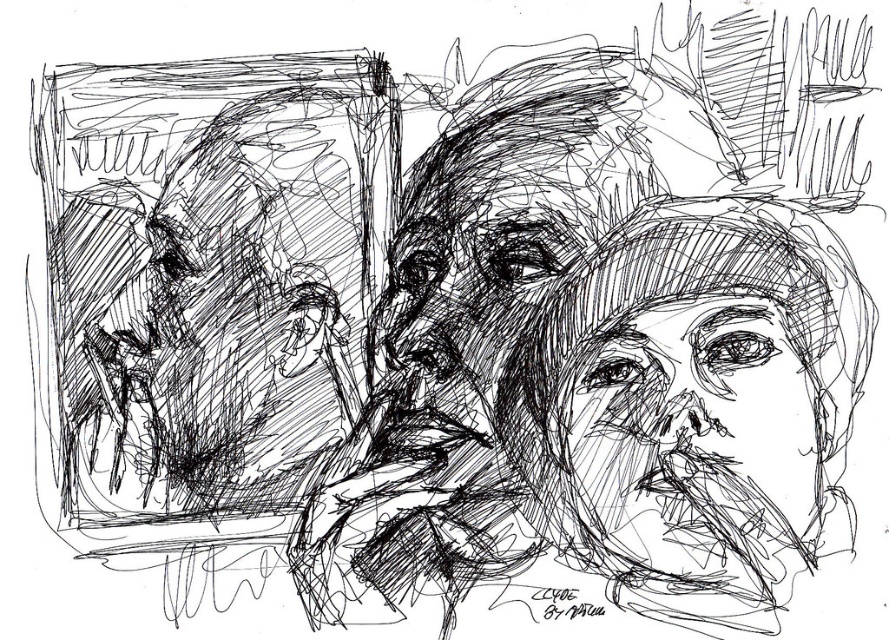
Question: Is black ink sketch of face at center positioned at the back of smooth black face at center?

Choices:
 (A) yes
 (B) no

Answer: (B)

Question: Is black ink sketch of face at center positioned behind smooth black face at center?

Choices:
 (A) no
 (B) yes

Answer: (A)

Question: Which point is closer to the camera?

Choices:
 (A) black ink sketch of face at center
 (B) smooth black face at center

Answer: (A)

Question: Which point is farther to the camera?

Choices:
 (A) (713, 440)
 (B) (735, 518)

Answer: (B)

Question: Does black ink sketch of face at center appear under smooth black face at center?

Choices:
 (A) yes
 (B) no

Answer: (B)